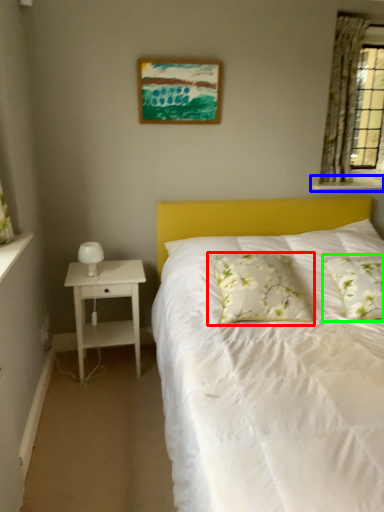
Question: Which object is the closest to the pillow (highlighted by a red box)? Choose among these: window sill (highlighted by a blue box) or pillow (highlighted by a green box).

Choices:
 (A) window sill
 (B) pillow

Answer: (B)